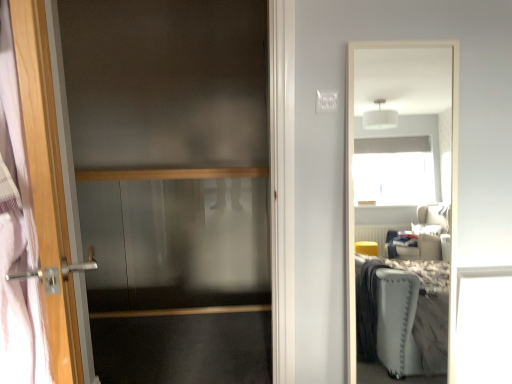
Question: Is satin wood balustrade at center oriented away from wooden door handle at left?

Choices:
 (A) no
 (B) yes

Answer: (A)

Question: From a real-world perspective, is satin wood balustrade at center beneath wooden door handle at left?

Choices:
 (A) no
 (B) yes

Answer: (B)

Question: Does satin wood balustrade at center have a greater height compared to wooden door handle at left?

Choices:
 (A) yes
 (B) no

Answer: (B)

Question: From the image's perspective, does satin wood balustrade at center appear lower than wooden door handle at left?

Choices:
 (A) yes
 (B) no

Answer: (B)

Question: Is satin wood balustrade at center smaller than wooden door handle at left?

Choices:
 (A) yes
 (B) no

Answer: (A)

Question: Looking at the image, does transparent glass screen door at left seem bigger or smaller compared to satin wood balustrade at center?

Choices:
 (A) small
 (B) big

Answer: (B)

Question: Relative to satin wood balustrade at center, is transparent glass screen door at left in front or behind?

Choices:
 (A) behind
 (B) front

Answer: (B)

Question: Is point (264, 21) positioned closer to the camera than point (227, 172)?

Choices:
 (A) closer
 (B) farther

Answer: (B)

Question: From the image's perspective, is transparent glass screen door at left located above or below satin wood balustrade at center?

Choices:
 (A) above
 (B) below

Answer: (B)

Question: Is satin wood balustrade at center wider or thinner than wooden door handle at left?

Choices:
 (A) thin
 (B) wide

Answer: (B)

Question: Is satin wood balustrade at center inside or outside of wooden door handle at left?

Choices:
 (A) outside
 (B) inside

Answer: (A)

Question: Based on their sizes in the image, would you say satin wood balustrade at center is bigger or smaller than wooden door handle at left?

Choices:
 (A) small
 (B) big

Answer: (A)

Question: In the image, is satin wood balustrade at center positioned in front of or behind wooden door handle at left?

Choices:
 (A) behind
 (B) front

Answer: (A)

Question: Based on their sizes in the image, would you say wooden door handle at left is bigger or smaller than transparent glass screen door at left?

Choices:
 (A) big
 (B) small

Answer: (A)

Question: In terms of width, does wooden door handle at left look wider or thinner when compared to transparent glass screen door at left?

Choices:
 (A) wide
 (B) thin

Answer: (A)